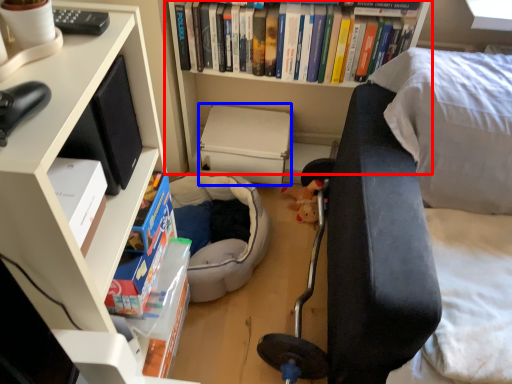
Question: Which of the following is the closest to the observer, bookcase (highlighted by a red box) or paperback book (highlighted by a blue box)?

Choices:
 (A) bookcase
 (B) paperback book

Answer: (A)